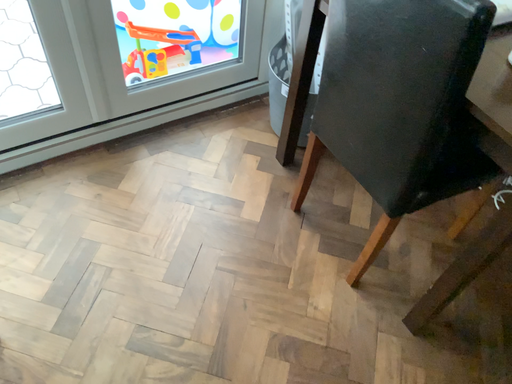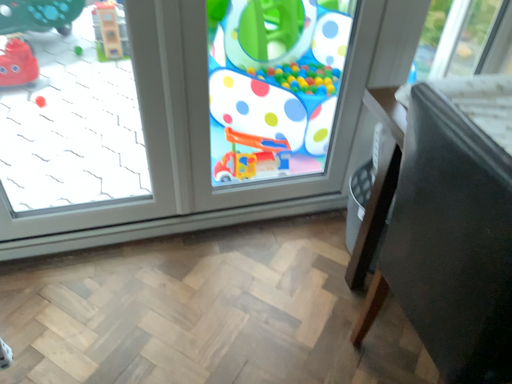
Question: How did the camera likely rotate when shooting the video?

Choices:
 (A) rotated upward
 (B) rotated downward

Answer: (A)